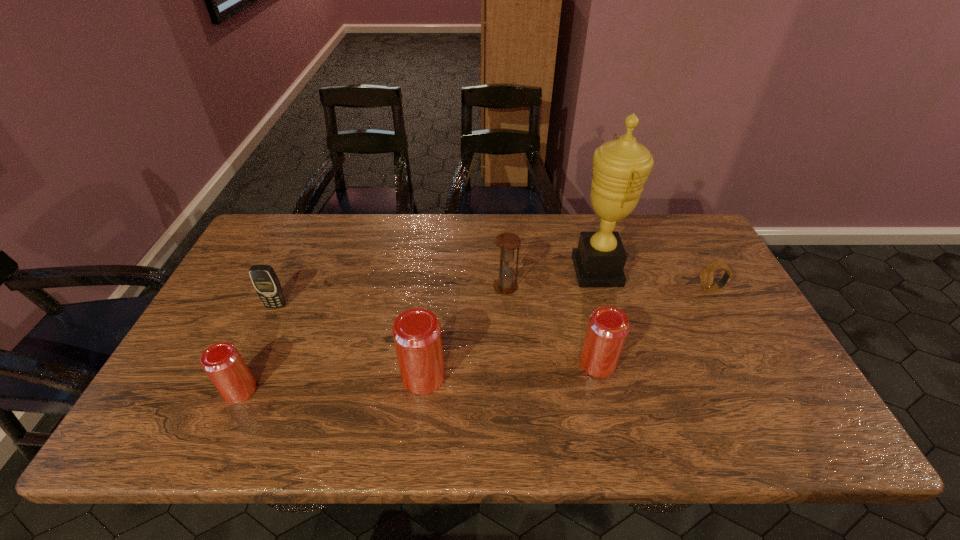
Find the location of a particular element. Image resolution: width=960 pixels, height=540 pixels. the second closest beer can to the shortest object is located at coordinates (416, 332).

You are a GUI agent. You are given a task and a screenshot of the screen. Output one action in this format:
    pyautogui.click(x=<x>, y=<y>)
    Task: Click on the free space that satisfies the following two spatial constraints: 1. on the front face of the second tallest beer can; 2. on the right side of the cellular telephone
    The image size is (960, 540).
    Given the screenshot: What is the action you would take?
    pyautogui.click(x=250, y=363)

Where is `vacant space that satisfies the following two spatial constraints: 1. on the front face of the fourth farthest object; 2. on the left side of the fifth object from right to left`? The image size is (960, 540). vacant space that satisfies the following two spatial constraints: 1. on the front face of the fourth farthest object; 2. on the left side of the fifth object from right to left is located at coordinates (244, 376).

I want to click on free space that satisfies the following two spatial constraints: 1. on the face of the shortest object; 2. on the front face of the cellular telephone, so click(719, 306).